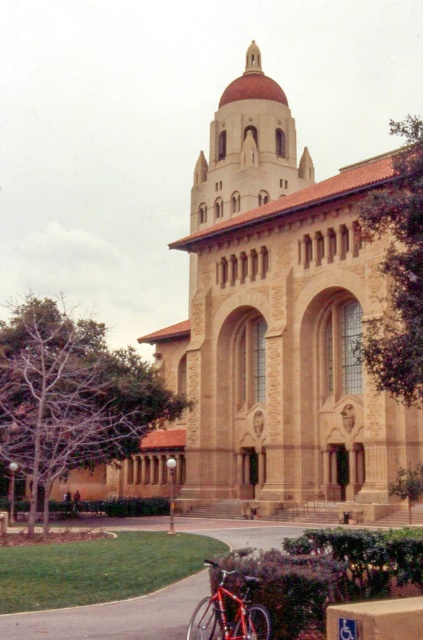
Question: Observing the image, what is the correct spatial positioning of smooth asphalt pavement at lower center in reference to cardboard at lower right?

Choices:
 (A) left
 (B) right

Answer: (A)

Question: Among these points, which one is farthest from the camera?

Choices:
 (A) (346, 604)
 (B) (370, 275)

Answer: (B)

Question: Which of the following is the farthest from the observer?

Choices:
 (A) (364, 604)
 (B) (233, 595)

Answer: (A)

Question: Which of the following is the closest to the observer?

Choices:
 (A) shiny red bicycle at lower left
 (B) smooth asphalt pavement at lower center

Answer: (A)

Question: Does beige stone church at center appear on the left side of cardboard at lower right?

Choices:
 (A) yes
 (B) no

Answer: (A)

Question: In this image, where is beige stone church at center located relative to shiny red bicycle at lower left?

Choices:
 (A) above
 (B) below

Answer: (A)